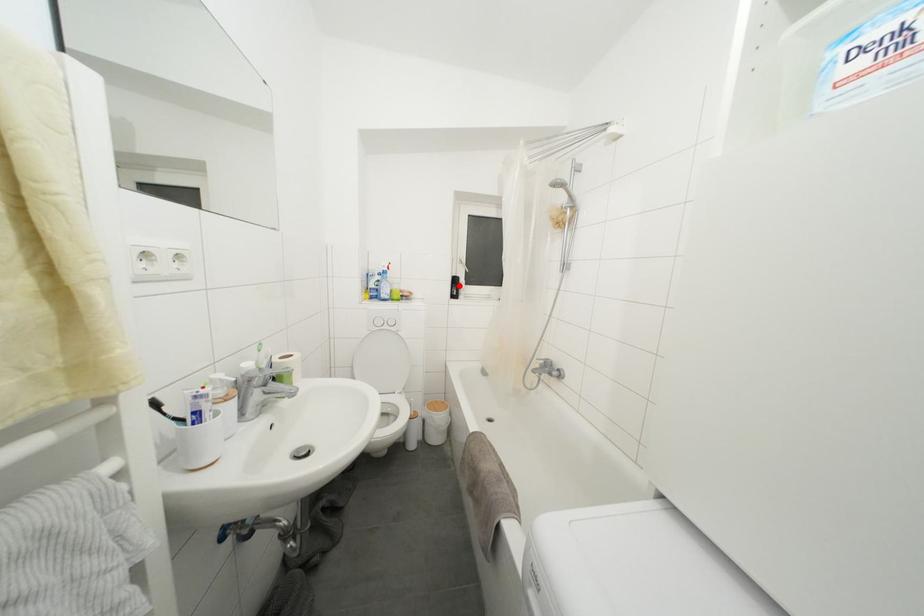
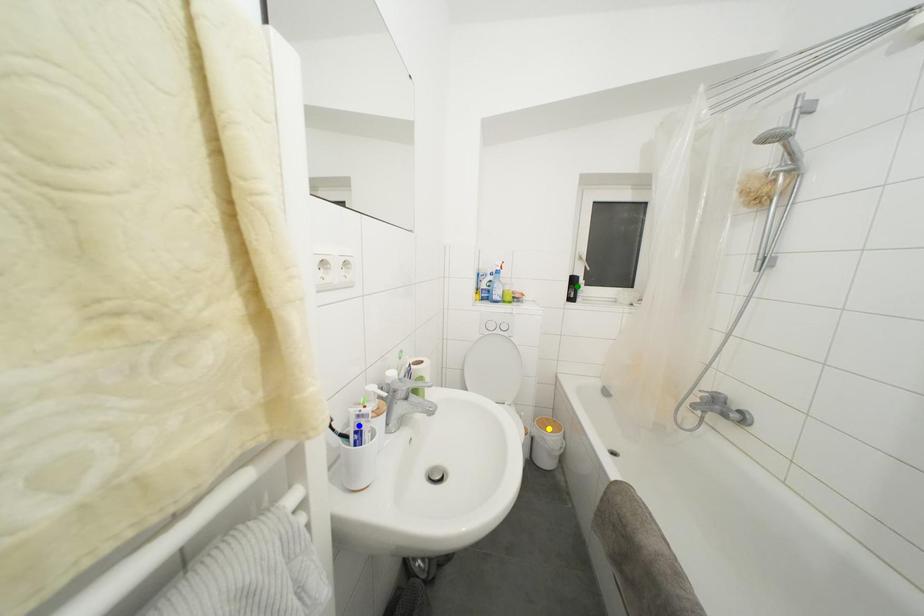
Question: I am providing you with two images of the same scene from different viewpoints. A red point is marked on the first image. You are given multiple points on the second image. Can you choose the point in image 2 that corresponds to the point in image 1?

Choices:
 (A) yellow point
 (B) green point
 (C) blue point

Answer: (B)